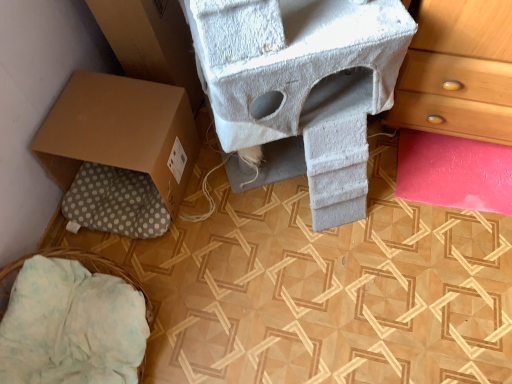
Question: Considering the positions of brown cardboard box at left and white fabric basket at lower left in the image, is brown cardboard box at left taller or shorter than white fabric basket at lower left?

Choices:
 (A) tall
 (B) short

Answer: (A)

Question: Is brown cardboard box at left bigger or smaller than white fabric basket at lower left?

Choices:
 (A) big
 (B) small

Answer: (A)

Question: Estimate the real-world distances between objects in this image. Which object is farther from the brown cardboard box at left?

Choices:
 (A) brown cardboard box at lower left
 (B) white fabric basket at lower left

Answer: (B)

Question: Estimate the real-world distances between objects in this image. Which object is closer to the brown cardboard box at left?

Choices:
 (A) brown cardboard box at lower left
 (B) white fabric basket at lower left

Answer: (A)